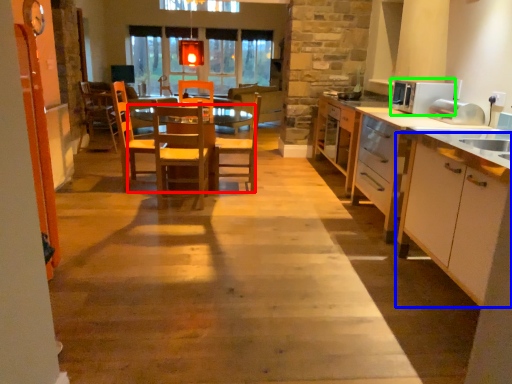
Question: Which object is the farthest from table (highlighted by a red box)? Choose among these: cabinetry (highlighted by a blue box) or appliance (highlighted by a green box).

Choices:
 (A) cabinetry
 (B) appliance

Answer: (A)